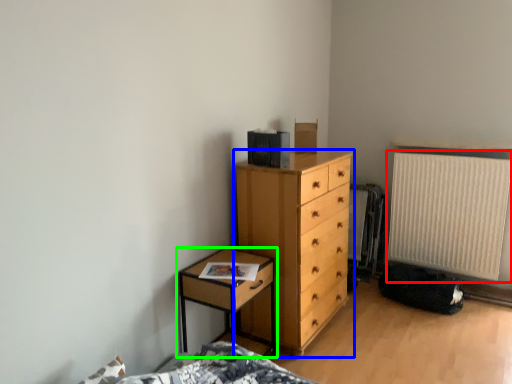
Question: Estimate the real-world distances between objects in this image. Which object is closer to radiator (highlighted by a red box), chest of drawers (highlighted by a blue box) or nightstand (highlighted by a green box)?

Choices:
 (A) chest of drawers
 (B) nightstand

Answer: (A)